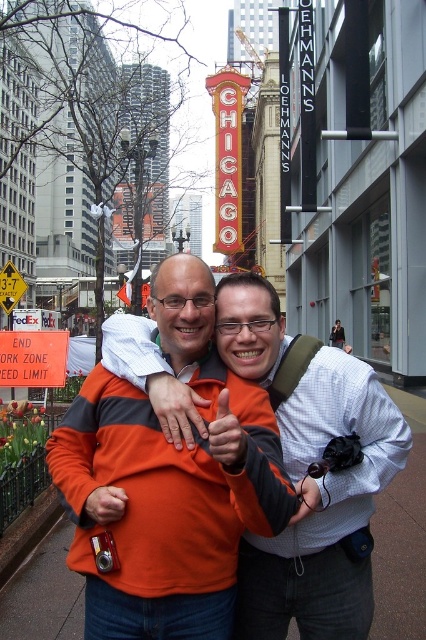
Does point (11, 362) lie in front of point (13, 272)?

Yes, point (11, 362) is closer to viewer.

Does orange plastic sign at lower left appear on the right side of yellowmaterial/texturestreet sign at left?

Indeed, orange plastic sign at lower left is positioned on the right side of yellowmaterial/texturestreet sign at left.

Between point (16, 365) and point (23, 282), which one is positioned behind?

Positioned behind is point (23, 282).

Find the location of a particular element. This screenshot has width=426, height=640. orange plastic sign at lower left is located at coordinates (32, 358).

Which is below, orange fleece jacket at center or yellowmaterial/texturestreet sign at left?

orange fleece jacket at center is lower down.

Between point (224, 396) and point (0, 275), which one is positioned in front?

Point (224, 396)

Locate an element on the screen. This screenshot has height=640, width=426. orange fleece jacket at center is located at coordinates (232, 467).

Is orange fleece jacket at center further to the viewer compared to orange plastic sign at lower left?

No, it is not.

Between orange fleece jacket at center and orange plastic sign at lower left, which one has less height?

With less height is orange plastic sign at lower left.

Locate an element on the screen. orange fleece jacket at center is located at coordinates (232, 467).